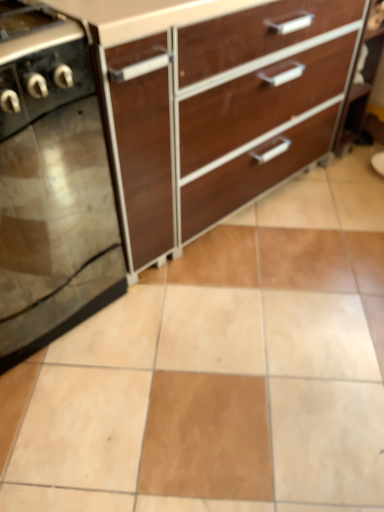
What do you see at coordinates (51, 183) in the screenshot? The width and height of the screenshot is (384, 512). I see `black glass stove at left` at bounding box center [51, 183].

The width and height of the screenshot is (384, 512). In order to click on black glass stove at left in this screenshot , I will do `click(51, 183)`.

In order to face black glass stove at left, should I rotate leftwards or rightwards?

Rotate your view left by about 24.003°.

This screenshot has width=384, height=512. Describe the element at coordinates (223, 112) in the screenshot. I see `brown wood chest of drawers at upper center` at that location.

The width and height of the screenshot is (384, 512). Identify the location of brown wood chest of drawers at upper center. 223,112.

In order to click on black glass stove at left in this screenshot , I will do `click(51, 183)`.

Is black glass stove at left at the left side of brown wood chest of drawers at upper center?

Yes, black glass stove at left is to the left of brown wood chest of drawers at upper center.

Which object is further away from the camera taking this photo, black glass stove at left or brown wood chest of drawers at upper center?

brown wood chest of drawers at upper center is more distant.

Which is in front, point (53, 296) or point (244, 75)?

The point (53, 296) is in front.

From the image's perspective, which one is positioned lower, black glass stove at left or brown wood chest of drawers at upper center?

black glass stove at left.

Looking at this image, from a real-world perspective, which object rests below the other?

black glass stove at left.

Considering the sizes of black glass stove at left and brown wood chest of drawers at upper center in the image, is black glass stove at left wider or thinner than brown wood chest of drawers at upper center?

black glass stove at left is thinner than brown wood chest of drawers at upper center.

Considering the relative sizes of black glass stove at left and brown wood chest of drawers at upper center in the image provided, is black glass stove at left shorter than brown wood chest of drawers at upper center?

Yes, black glass stove at left is shorter than brown wood chest of drawers at upper center.

Based on the photo, can you confirm if black glass stove at left is bigger than brown wood chest of drawers at upper center?

No.

Is black glass stove at left situated inside brown wood chest of drawers at upper center or outside?

black glass stove at left lies outside brown wood chest of drawers at upper center.

Is black glass stove at left touching brown wood chest of drawers at upper center?

No.

Does black glass stove at left turn towards brown wood chest of drawers at upper center?

No, black glass stove at left is not facing towards brown wood chest of drawers at upper center.

This screenshot has height=512, width=384. Identify the location of the chest of drawers above the black glass stove at left (from a real-world perspective). [x=223, y=112].

Between brown wood chest of drawers at upper center and black glass stove at left, which one appears on the right side from the viewer's perspective?

brown wood chest of drawers at upper center is more to the right.

Is the depth of brown wood chest of drawers at upper center greater than that of black glass stove at left?

That is True.

Is point (153, 156) behind point (8, 175)?

Yes, point (153, 156) is behind point (8, 175).

From the image's perspective, is brown wood chest of drawers at upper center positioned above or below black glass stove at left?

Based on their image positions, brown wood chest of drawers at upper center is located above black glass stove at left.

From a real-world perspective, which is physically below, brown wood chest of drawers at upper center or black glass stove at left?

In real-world perspective, black glass stove at left is lower.

Which of these two, brown wood chest of drawers at upper center or black glass stove at left, is thinner?

With smaller width is black glass stove at left.

From their relative heights in the image, would you say brown wood chest of drawers at upper center is taller or shorter than black glass stove at left?

brown wood chest of drawers at upper center is taller than black glass stove at left.

Considering the relative sizes of brown wood chest of drawers at upper center and black glass stove at left in the image provided, is brown wood chest of drawers at upper center bigger than black glass stove at left?

Indeed, brown wood chest of drawers at upper center has a larger size compared to black glass stove at left.

In the scene shown: Is brown wood chest of drawers at upper center inside or outside of black glass stove at left?

brown wood chest of drawers at upper center is not enclosed by black glass stove at left.

Can you see brown wood chest of drawers at upper center touching black glass stove at left?

No, brown wood chest of drawers at upper center is not in contact with black glass stove at left.

Could you tell me if brown wood chest of drawers at upper center is turned towards black glass stove at left?

No, brown wood chest of drawers at upper center is not oriented towards black glass stove at left.

Can you tell me how much brown wood chest of drawers at upper center and black glass stove at left differ in facing direction?

The facing directions of brown wood chest of drawers at upper center and black glass stove at left are 5.48e-05 degrees apart.

The image size is (384, 512). Identify the location of chest of drawers that appears on the right of black glass stove at left. click(x=223, y=112).

Image resolution: width=384 pixels, height=512 pixels. I want to click on home appliance in front of the brown wood chest of drawers at upper center, so click(x=51, y=183).

Identify the location of chest of drawers located on the right of black glass stove at left. (223, 112).